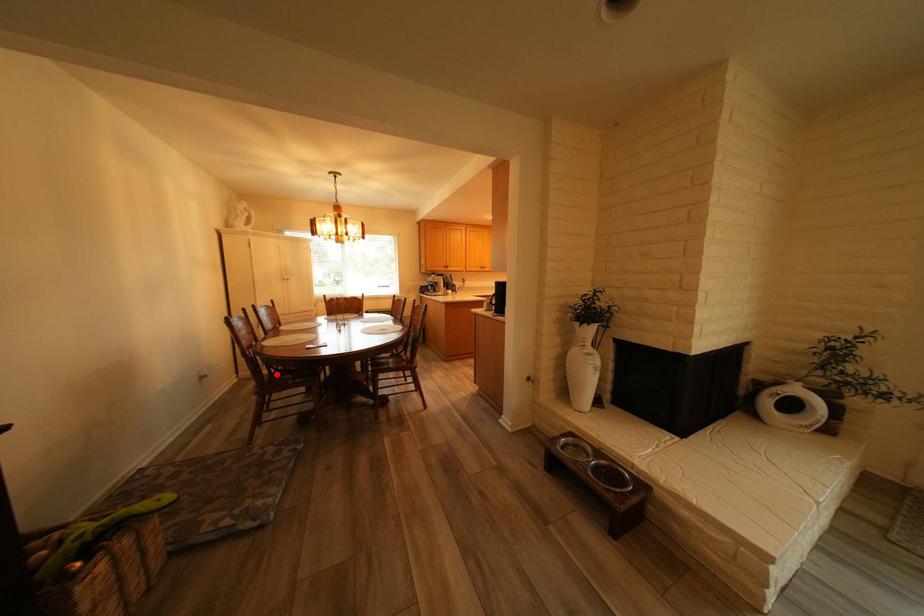
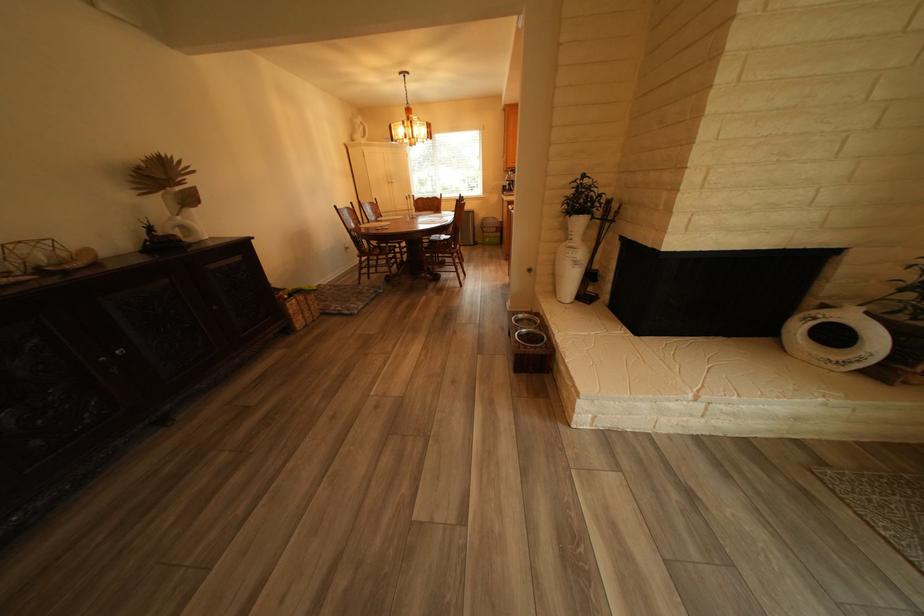
Where in the second image is the point corresponding to the highlighted location from the first image?

(379, 246)